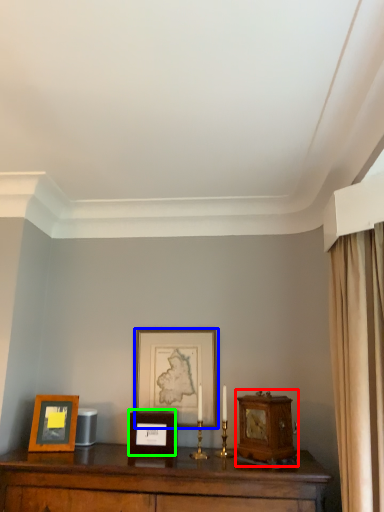
Question: Which object is positioned farthest from alarm clock (highlighted by a red box)? Select from picture frame (highlighted by a blue box) and picture frame (highlighted by a green box).

Choices:
 (A) picture frame
 (B) picture frame

Answer: (A)